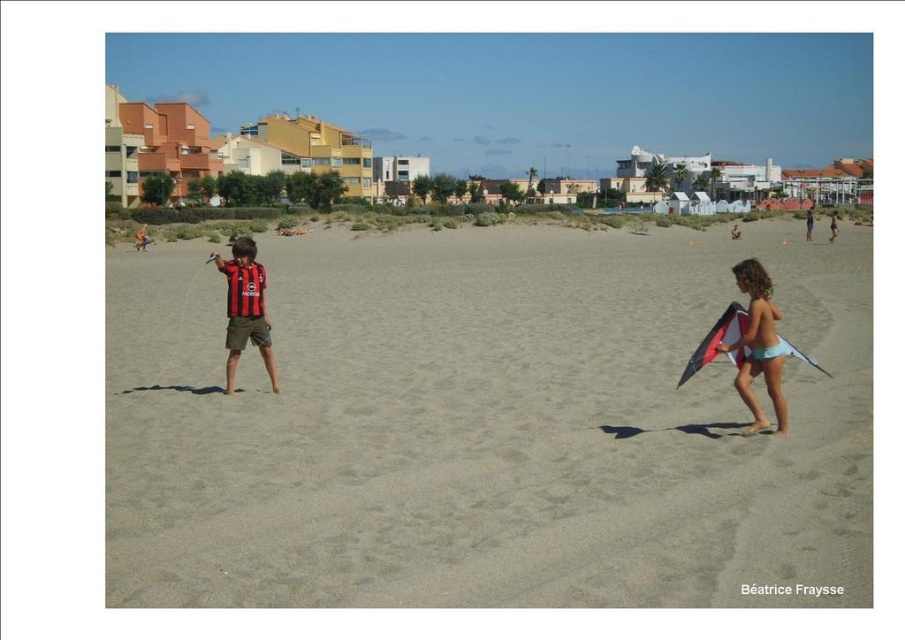
Question: Can you confirm if teal fabric bikini at right is positioned to the right of black jersey at center?

Choices:
 (A) no
 (B) yes

Answer: (B)

Question: Among these objects, which one is nearest to the camera?

Choices:
 (A) black jersey at center
 (B) multicolored fabric kite at right
 (C) teal fabric bikini at right

Answer: (C)

Question: Estimate the real-world distances between objects in this image. Which object is farther from the multicolored fabric kite at right?

Choices:
 (A) smooth sand at center
 (B) teal fabric bikini at right

Answer: (A)

Question: Is teal fabric bikini at right positioned at the back of black jersey at center?

Choices:
 (A) no
 (B) yes

Answer: (A)

Question: Considering the real-world distances, which object is closest to the teal fabric bikini at right?

Choices:
 (A) multicolored fabric kite at right
 (B) black jersey at center

Answer: (A)

Question: Does smooth sand at center have a smaller size compared to teal fabric bikini at right?

Choices:
 (A) yes
 (B) no

Answer: (B)